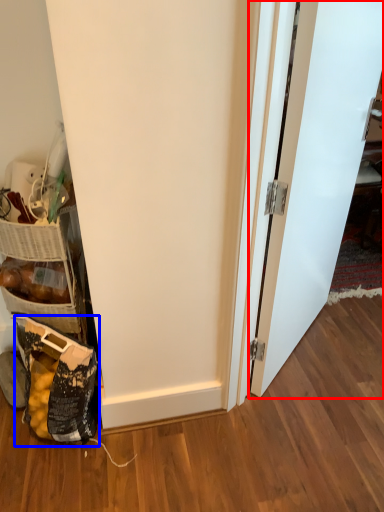
Question: Which object appears farthest to the camera in this image, door (highlighted by a red box) or material (highlighted by a blue box)?

Choices:
 (A) door
 (B) material

Answer: (B)